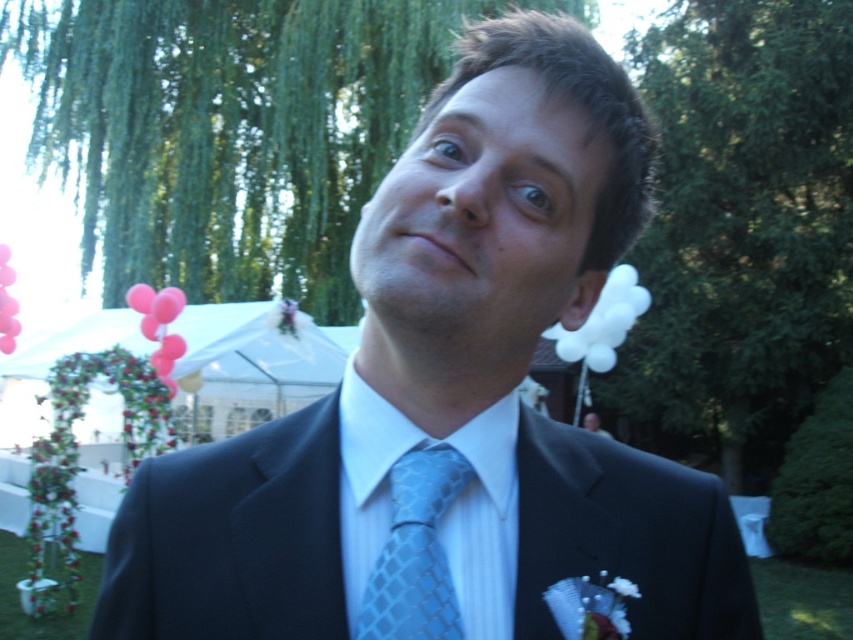
Looking at this image, you are a photographer at a wedding event. You need to capture a closeup shot of the light blue textured tie at center and the black satin suit at center. Based on their positions, which one should you focus on first to ensure both are in focus?

The black satin suit at center is below the light blue textured tie at center, so you should focus on the light blue textured tie at center first as it is closer to the camera.

You are standing at the location of the viewer and want to reach the point marked at coordinate point (317,410). If your arms are 28 inches long, can you reach that point without moving your feet?

The point marked at coordinate point (317,410) is 28.54 inches away from the viewer. Since your arms are only 28 inches long, you cannot reach that point without moving your feet.

You are a photographer at the event and want to position yourself such that both the point at (x=312, y=628) and the point at (x=447, y=595) are in your shot. Given their depth relationship, which point should be placed closer to the front of your frame to ensure both are visible?

Since point (x=312, y=628) is closer to the viewer than point (x=447, y=595), you should position the point at (x=312, y=628) closer to the front of your frame to ensure both are visible in the photograph.